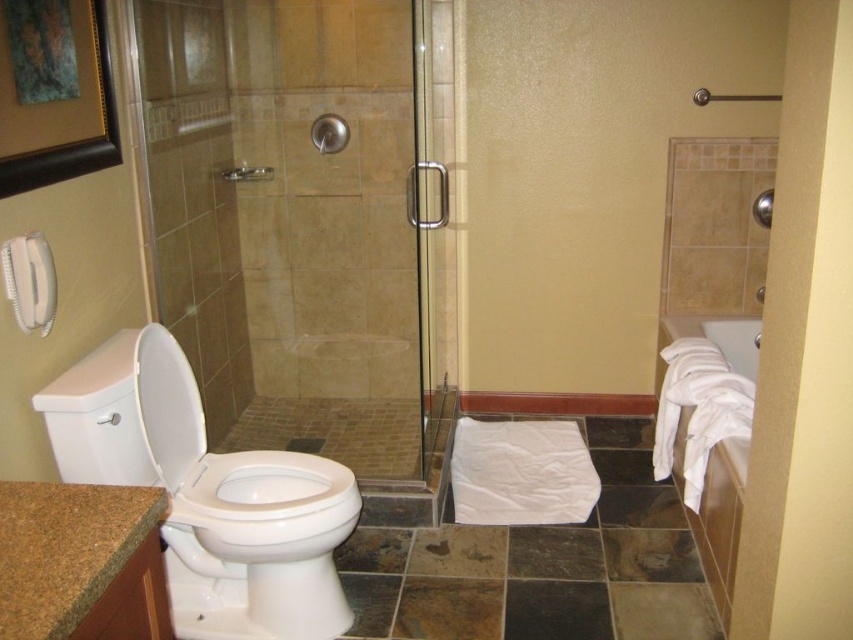
Could you measure the distance between transparent glass shower door at center and white glossy toilet bowl at lower left?

A distance of 82.71 centimeters exists between transparent glass shower door at center and white glossy toilet bowl at lower left.

Is transparent glass shower door at center above white glossy toilet bowl at lower left?

Yes.

Which is in front, point (387, 340) or point (231, 493)?

Point (231, 493) is in front.

What are the coordinates of `transparent glass shower door at center` in the screenshot? It's located at (288, 220).

Can you confirm if white glossy toilet bowl at left is shorter than white glossy toilet bowl at lower left?

No, white glossy toilet bowl at left is not shorter than white glossy toilet bowl at lower left.

Is point (320, 465) more distant than point (181, 605)?

Yes, it is behind point (181, 605).

This screenshot has height=640, width=853. Find the location of `white glossy toilet bowl at left`. white glossy toilet bowl at left is located at coordinates (207, 493).

Can you confirm if white glossy toilet bowl at left is wider than clear glass shower door at center?

Indeed, white glossy toilet bowl at left has a greater width compared to clear glass shower door at center.

Who is more distant from viewer, (x=141, y=433) or (x=445, y=342)?

Point (x=445, y=342)

I want to click on white glossy toilet bowl at left, so click(207, 493).